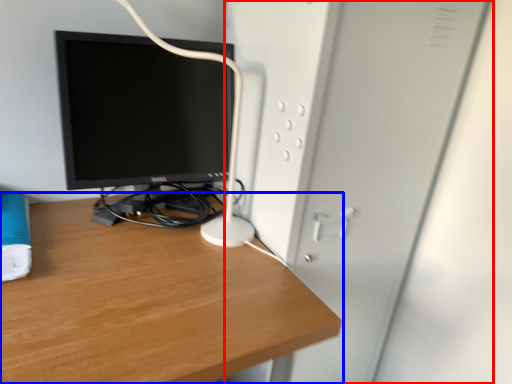
Question: Among these objects, which one is nearest to the camera, file cabinet (highlighted by a red box) or desk (highlighted by a blue box)?

Choices:
 (A) file cabinet
 (B) desk

Answer: (B)